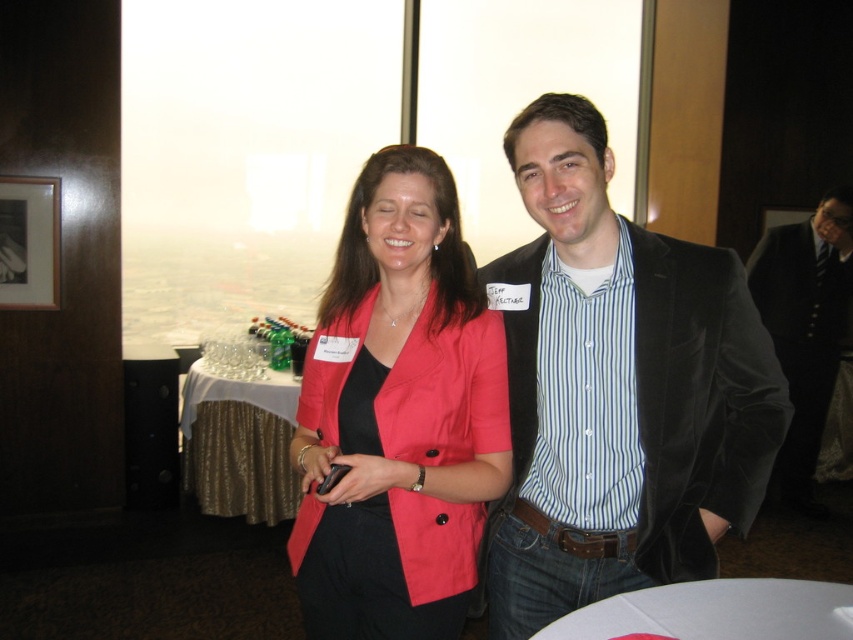
Is black velvet suit at right positioned at the back of white glossy table at lower center?

Yes.

Which is in front, point (805, 468) or point (682, 595)?

Positioned in front is point (682, 595).

Find the location of `black velvet suit at right`. black velvet suit at right is located at coordinates tap(805, 326).

Is matte red blazer at center further to camera compared to gold sequined tablecloth at center?

No, matte red blazer at center is closer to the viewer.

Is point (401, 250) closer to viewer compared to point (286, 476)?

That is True.

Locate an element on the screen. Image resolution: width=853 pixels, height=640 pixels. matte red blazer at center is located at coordinates (398, 416).

Does gold sequined tablecloth at center have a lesser width compared to white glossy table at lower center?

In fact, gold sequined tablecloth at center might be wider than white glossy table at lower center.

Is point (193, 477) closer to viewer compared to point (723, 634)?

No, (193, 477) is further to viewer.

This screenshot has width=853, height=640. In order to click on gold sequined tablecloth at center in this screenshot , I will do `click(239, 445)`.